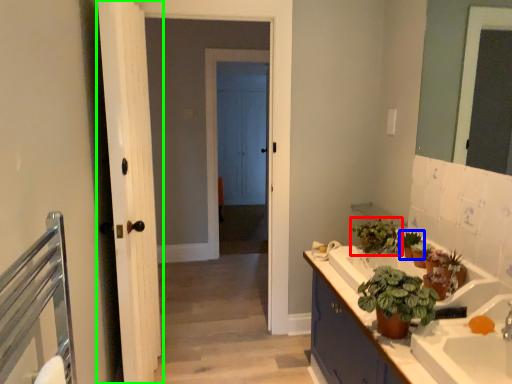
Question: Which object is positioned farthest from houseplant (highlighted by a red box)? Select from houseplant (highlighted by a blue box) and door (highlighted by a green box).

Choices:
 (A) houseplant
 (B) door

Answer: (B)